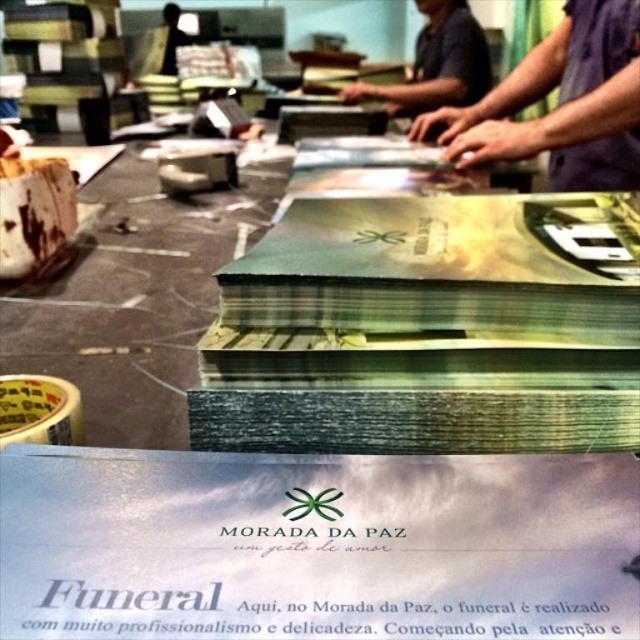
Can you confirm if purple sleeveless shirt at upper right is positioned to the left of black fabric at upper left?

In fact, purple sleeveless shirt at upper right is to the right of black fabric at upper left.

Who is more forward, (x=637, y=24) or (x=176, y=36)?

Point (x=637, y=24) is in front.

Measure the distance between point (573, 88) and camera.

A distance of 1.55 meters exists between point (573, 88) and camera.

Locate an element on the screen. purple sleeveless shirt at upper right is located at coordinates (561, 104).

Between dark blue shirt at upper center and black fabric at upper left, which one is positioned higher?

black fabric at upper left is higher up.

Is dark blue shirt at upper center above black fabric at upper left?

No, dark blue shirt at upper center is not above black fabric at upper left.

Where is `dark blue shirt at upper center`? dark blue shirt at upper center is located at coordinates (435, 65).

Where is `dark blue shirt at upper center`? dark blue shirt at upper center is located at coordinates click(435, 65).

Does purple sleeveless shirt at upper right have a greater width compared to dark blue shirt at upper center?

No.

Is purple sleeveless shirt at upper right further to the viewer compared to dark blue shirt at upper center?

No, purple sleeveless shirt at upper right is in front of dark blue shirt at upper center.

Is point (593, 40) positioned in front of point (444, 20)?

Yes, it is.

The height and width of the screenshot is (640, 640). Find the location of `purple sleeveless shirt at upper right`. purple sleeveless shirt at upper right is located at coordinates (561, 104).